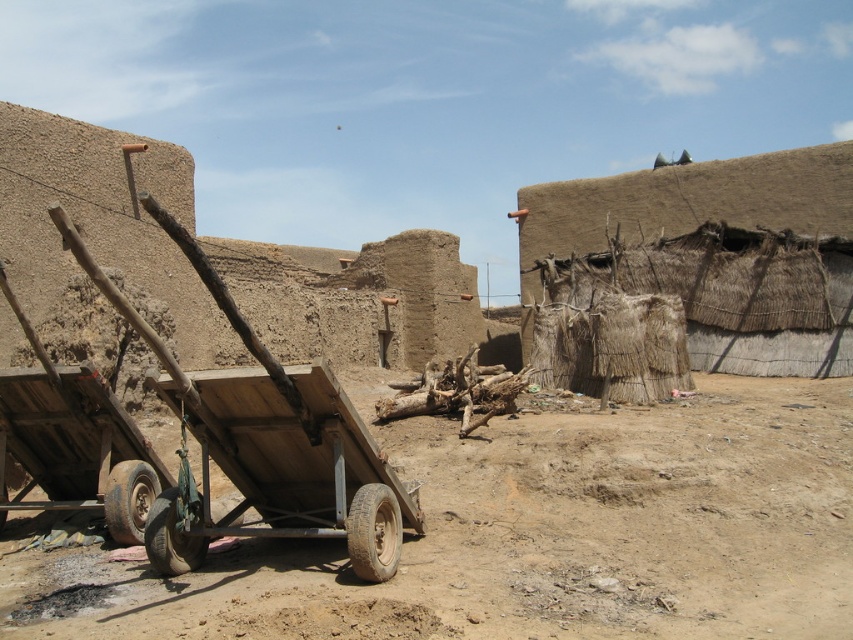
You are standing at the edge of the sandy area and want to move towards the wooden wagon. Which direction should you go to reach the wooden wagon at center from the brown sandy dirt at lower left?

To reach the wooden wagon at center from the brown sandy dirt at lower left, you should move towards the center since the wooden wagon at center is taller than the brown sandy dirt at lower left.